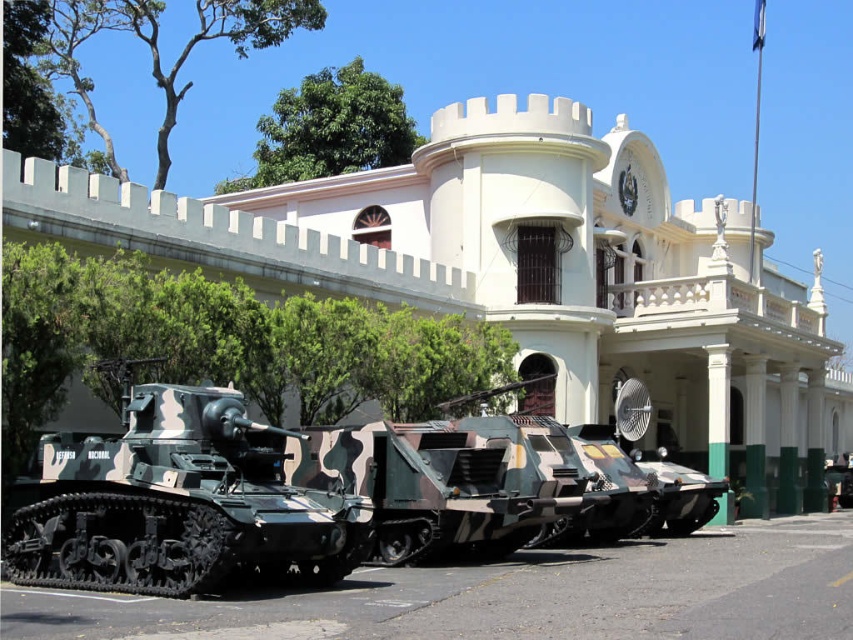
You are standing at the point marked as point (x=524, y=275) in the image. What object are you facing?

You are facing the white smooth building at center.